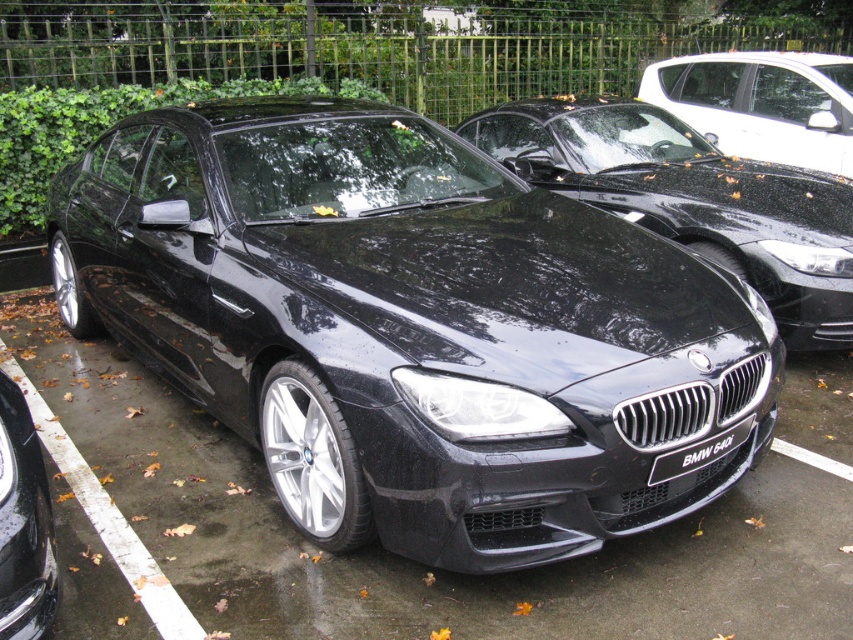
Question: Which object appears farthest from the camera in this image?

Choices:
 (A) glossy black car at center
 (B) glossy black sedan at center

Answer: (A)

Question: Is glossy black sedan at center positioned in front of glossy black car at upper right?

Choices:
 (A) no
 (B) yes

Answer: (B)

Question: Does glossy black car at center have a smaller size compared to glossy black car at upper right?

Choices:
 (A) yes
 (B) no

Answer: (B)

Question: Estimate the real-world distances between objects in this image. Which object is closer to the glossy black car at center?

Choices:
 (A) glossy black sedan at center
 (B) black plastic license plate at front

Answer: (A)

Question: Can you confirm if glossy black car at center is positioned to the left of black plastic license plate at front?

Choices:
 (A) yes
 (B) no

Answer: (B)

Question: Among these points, which one is nearest to the camera?

Choices:
 (A) (361, 216)
 (B) (715, 448)

Answer: (B)